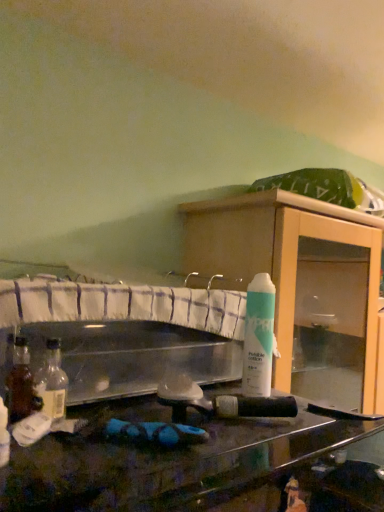
Question: Considering the positions of translucent glass bottle at left, the first bottle when ordered from right to left, and white matte spray can at upper right in the image, is translucent glass bottle at left, the first bottle when ordered from right to left, taller or shorter than white matte spray can at upper right?

Choices:
 (A) short
 (B) tall

Answer: (A)

Question: Is translucent glass bottle at left, the 2th bottle viewed from the left, inside or outside of white matte spray can at upper right?

Choices:
 (A) outside
 (B) inside

Answer: (A)

Question: Estimate the real-world distances between objects in this image. Which object is farther from the translucent glass bottle at left, the 2th bottle from the front?

Choices:
 (A) wooden cabinet at center
 (B) white matte spray can at upper right
 (C) translucent plastic bottle at lower left, positioned as the 1th bottle in front-to-back order

Answer: (A)

Question: Which object is positioned closest to the translucent plastic bottle at lower left, which appears as the second bottle when viewed from the back?

Choices:
 (A) white matte spray can at upper right
 (B) wooden cabinet at center
 (C) translucent glass bottle at left, the 2th bottle viewed from the left

Answer: (C)